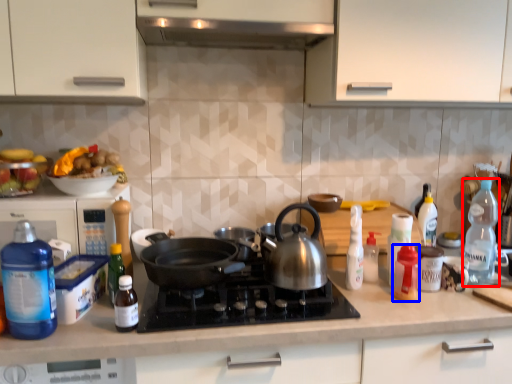
Question: Which object appears farthest to the camera in this image, bottle (highlighted by a red box) or bottle (highlighted by a blue box)?

Choices:
 (A) bottle
 (B) bottle

Answer: (A)